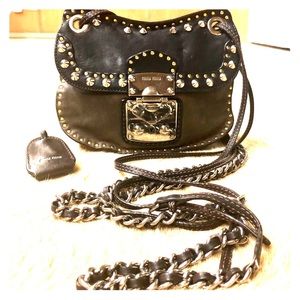
Locate an element on the screen. This screenshot has width=300, height=300. wood planks is located at coordinates (28, 22), (45, 18), (116, 10), (136, 13), (157, 13), (181, 12), (236, 15).